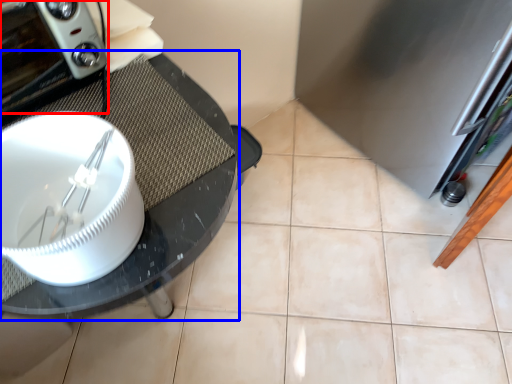
Question: Which object is closer to the camera taking this photo, home appliance (highlighted by a red box) or glass table (highlighted by a blue box)?

Choices:
 (A) home appliance
 (B) glass table

Answer: (A)